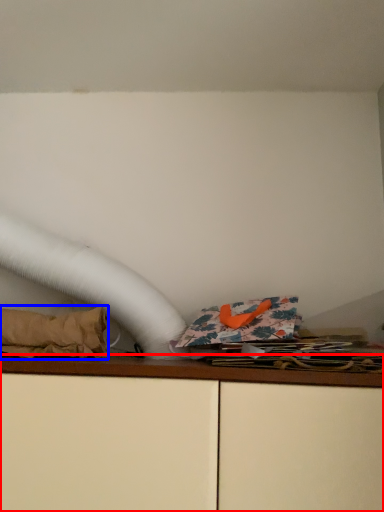
Question: Which object is closer to the camera taking this photo, furniture (highlighted by a red box) or material (highlighted by a blue box)?

Choices:
 (A) furniture
 (B) material

Answer: (A)